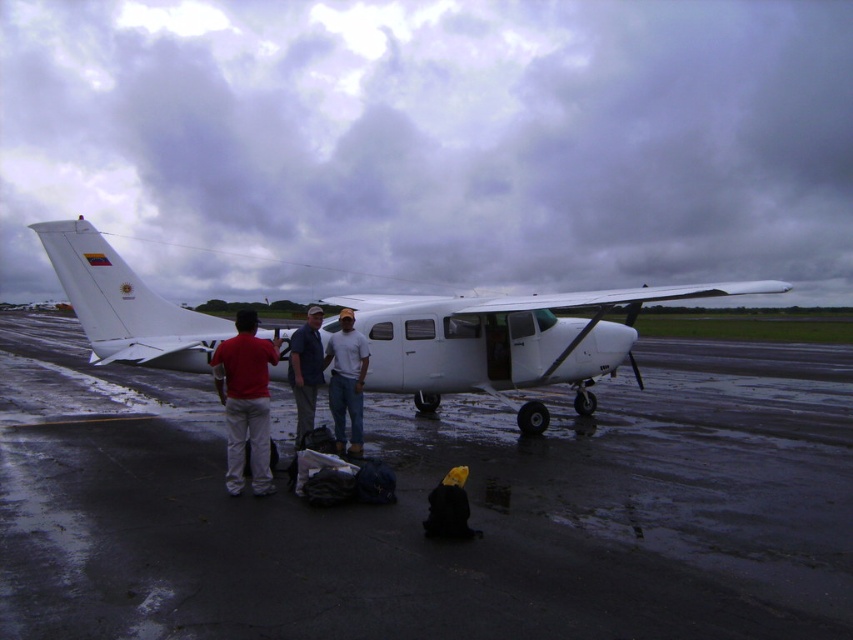
Is white cotton shirt at center to the right of white matte shirt at center from the viewer's perspective?

Correct, you'll find white cotton shirt at center to the right of white matte shirt at center.

Can you confirm if white cotton shirt at center is taller than white matte shirt at center?

No.

Measure the distance between white cotton shirt at center and camera.

white cotton shirt at center and camera are 21.41 feet apart from each other.

Identify the location of white cotton shirt at center. (346, 381).

Does wet asphalt tarmac at center appear on the left side of matte red shirt at center?

Incorrect, wet asphalt tarmac at center is not on the left side of matte red shirt at center.

Locate an element on the screen. The height and width of the screenshot is (640, 853). wet asphalt tarmac at center is located at coordinates point(424,506).

At what (x,y) coordinates should I click in order to perform the action: click on wet asphalt tarmac at center. Please return your answer as a coordinate pair (x, y). The height and width of the screenshot is (640, 853). Looking at the image, I should click on pyautogui.click(x=424, y=506).

Who is higher up, wet asphalt tarmac at center or white matte airplane at center?

Positioned higher is white matte airplane at center.

Is wet asphalt tarmac at center further to camera compared to white matte airplane at center?

No, it is not.

Which is in front, point (576, 577) or point (601, 348)?

Point (576, 577)

The height and width of the screenshot is (640, 853). I want to click on wet asphalt tarmac at center, so click(x=424, y=506).